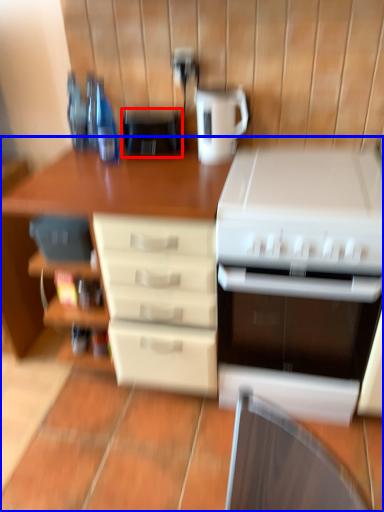
Question: Which of the following is the farthest to the observer, appliance (highlighted by a red box) or desk (highlighted by a blue box)?

Choices:
 (A) appliance
 (B) desk

Answer: (A)